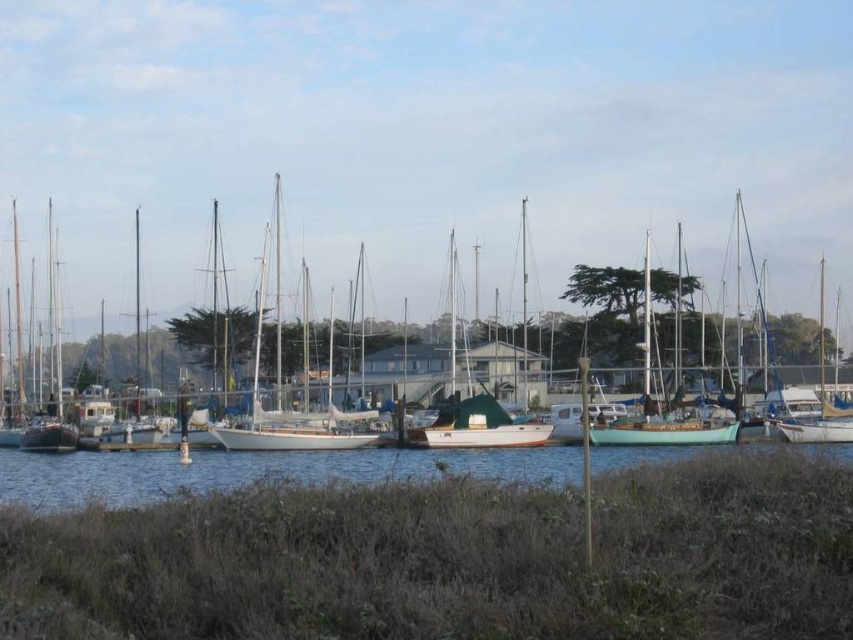
You are standing on the grassy area in the foreground and want to walk to the teal matte sailboat at center. Which direction should you head towards relative to the blue water at lower center?

You should head towards the right side of the blue water at lower center because the teal matte sailboat at center is positioned to the right of the blue water at lower center.

You are standing at the point marked by point (451, 560) in the image. Looking around, you see a smooth white boat at center. What is the nearest object to you?

The nearest object to you is the smooth white boat at center, as you are standing exactly at the point that indicates its location.